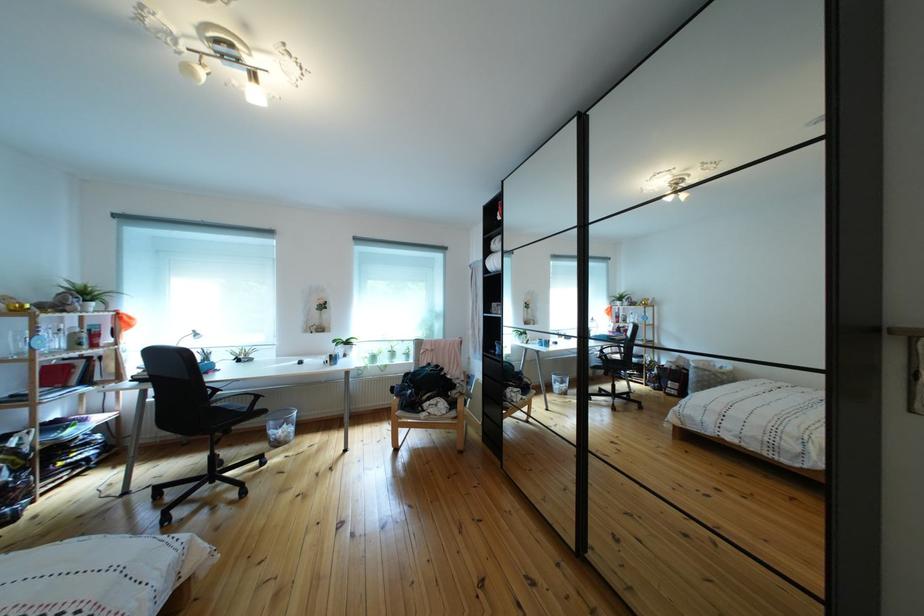
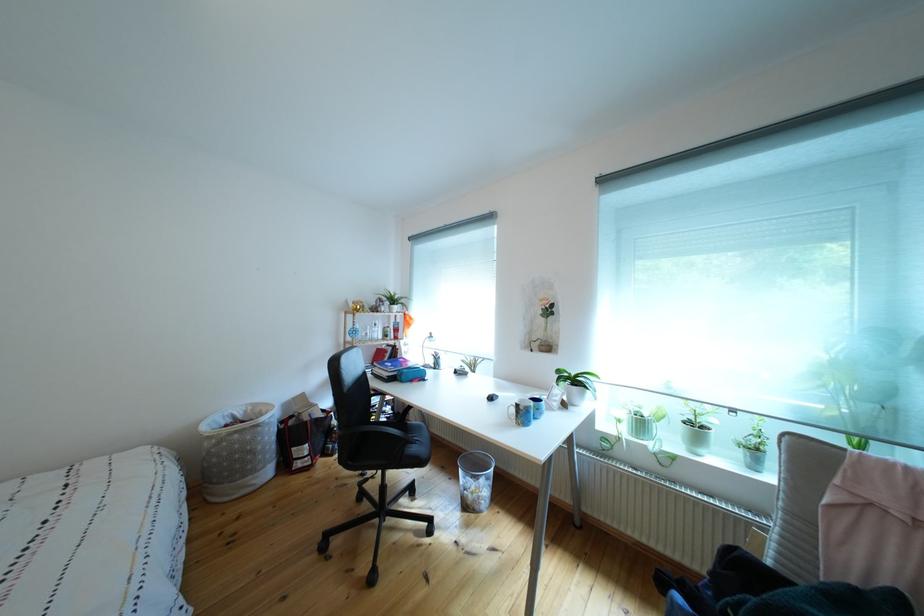
Where in the second image is the point corresponding to (x=345, y=365) from the first image?

(533, 419)